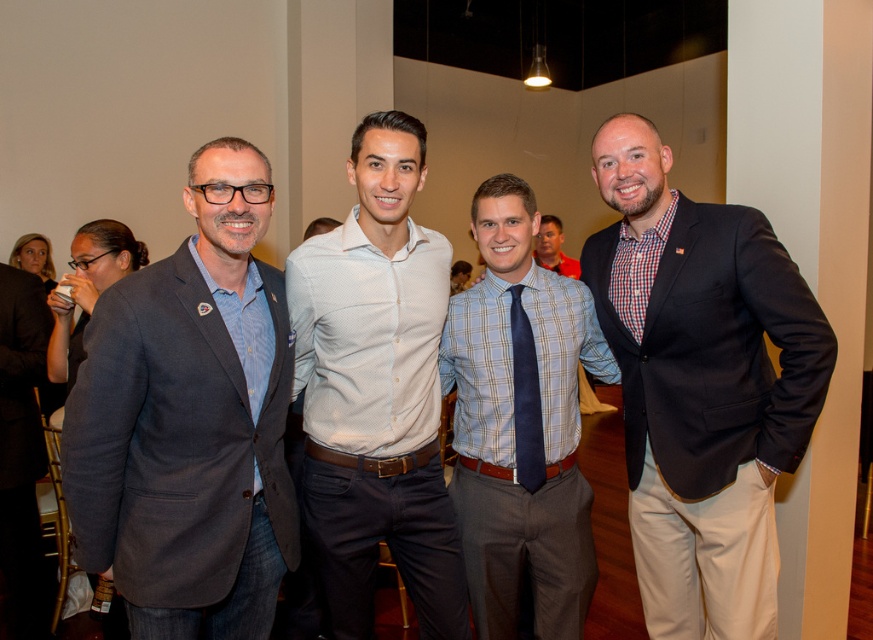
Question: Can you confirm if white textured shirt at center is thinner than blue plaid shirt at center?

Choices:
 (A) yes
 (B) no

Answer: (A)

Question: Is dark blue suit at right below white textured shirt at center?

Choices:
 (A) yes
 (B) no

Answer: (A)

Question: Which point is farther to the camera?

Choices:
 (A) blue plaid shirt at center
 (B) navy satin tie at center
 (C) matte gray blazer at left
 (D) white textured shirt at center

Answer: (A)

Question: Does dark blue suit at right appear on the left side of navy satin tie at center?

Choices:
 (A) yes
 (B) no

Answer: (B)

Question: Which point is closer to the camera?

Choices:
 (A) dark blue suit at right
 (B) blue plaid shirt at center

Answer: (A)

Question: Which object is positioned farthest from the white textured shirt at center?

Choices:
 (A) blue plaid shirt at center
 (B) matte gray blazer at left

Answer: (B)